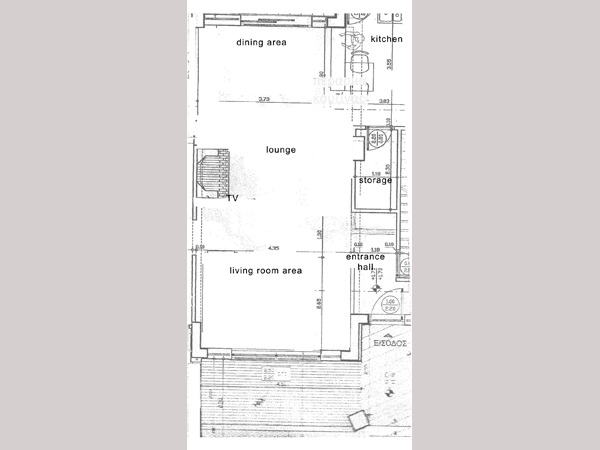
Where is `tv`? The width and height of the screenshot is (600, 450). tv is located at coordinates (231, 197).